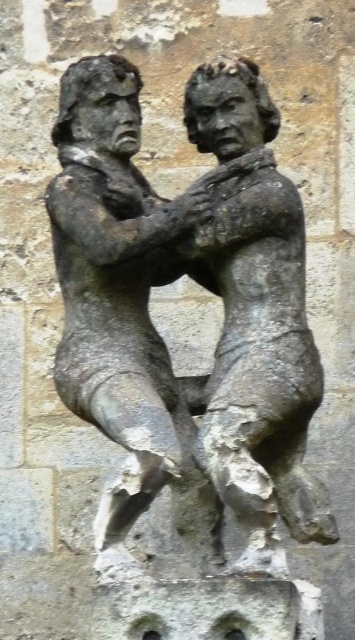
You are an art conservator examining the two statues in the image. Which statue is positioned closer to you, the stone statue of man at center or the bronze statue at center?

The stone statue of man at center is closer to you because the bronze statue at center is positioned behind it.

You are a tour guide leading a group near two statues in the image. You need to inform visitors about the distance between the stone statue of man at center and the bronze statue at center. What do you tell them?

The stone statue of man at center is 1.71 meters away from the bronze statue at center.

You are an archaeologist examining the stone sculpture. You notice a specific point at coordinates [121,298]. What does this point indicate?

The point at coordinates [121,298] indicates the location of the stone statue of man at center.